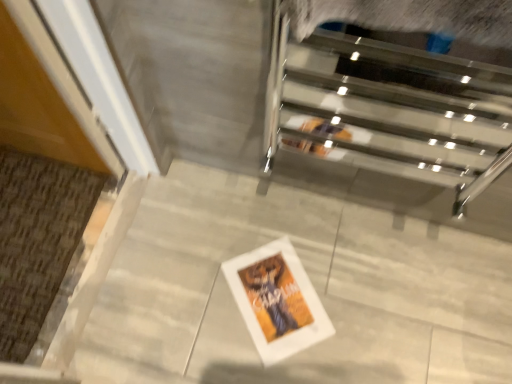
The width and height of the screenshot is (512, 384). Identify the location of free spot in front of white matte picture frame at center. (266, 363).